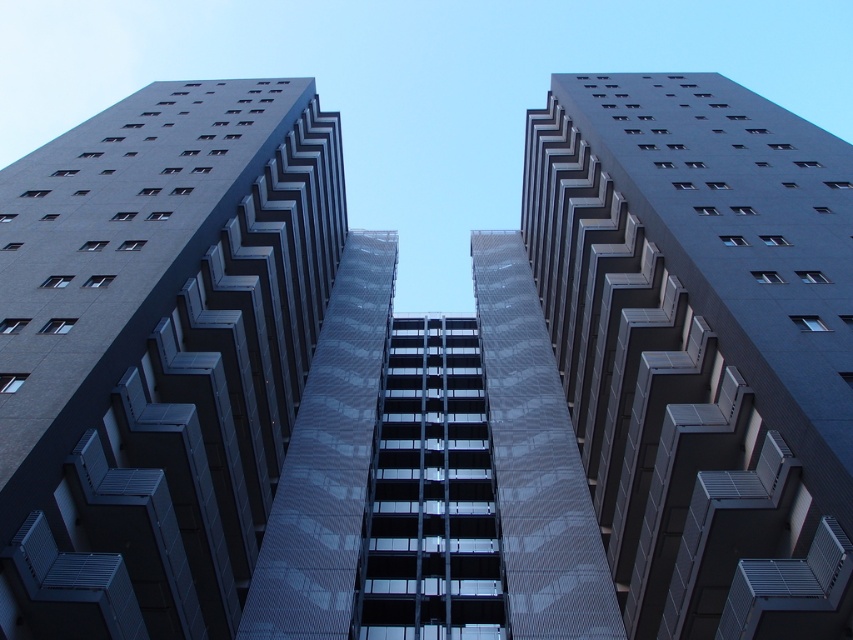
Looking at this image, between smooth glass building at center and smooth concrete building at center, which one has more height?

Standing taller between the two is smooth glass building at center.

Is smooth glass building at center bigger than smooth concrete building at center?

Indeed, smooth glass building at center has a larger size compared to smooth concrete building at center.

In order to click on smooth glass building at center in this screenshot , I will do `click(157, 352)`.